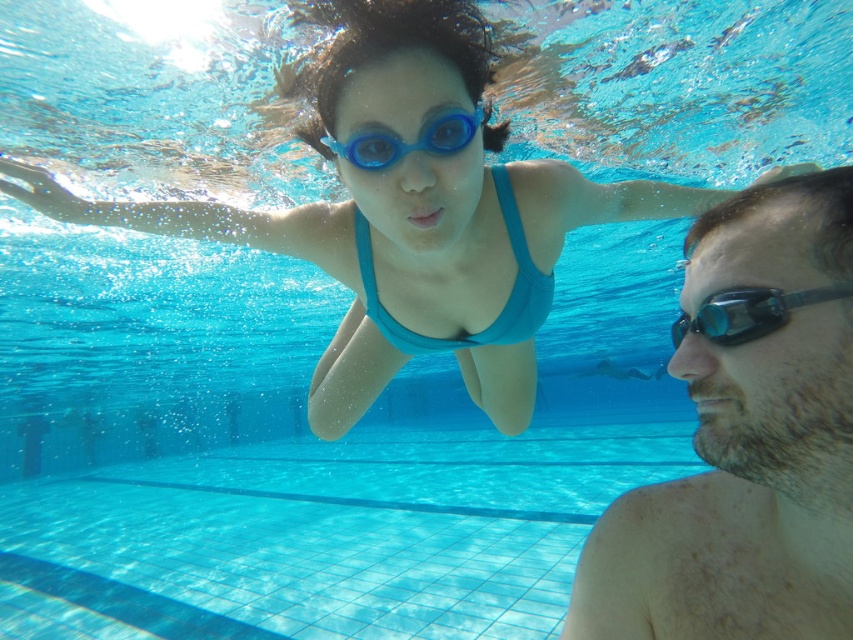
Question: Is smooth skin face at right positioned behind transparent rubber goggles at right?

Choices:
 (A) no
 (B) yes

Answer: (B)

Question: Is smooth skin face at right further to camera compared to transparent rubber goggles at right?

Choices:
 (A) no
 (B) yes

Answer: (B)

Question: Which object is farther from the camera taking this photo?

Choices:
 (A) blue matte swimsuit at center
 (B) teal fabric bikini top at center
 (C) transparent rubber goggles at right
 (D) smooth skin face at right

Answer: (B)

Question: Can you confirm if blue matte swimsuit at center is positioned to the left of teal fabric bikini top at center?

Choices:
 (A) yes
 (B) no

Answer: (A)

Question: Based on their relative distances, which object is nearer to the teal fabric bikini top at center?

Choices:
 (A) transparent rubber goggles at right
 (B) blue matte swimsuit at center
 (C) blue rubber goggles at center
 (D) smooth skin face at right

Answer: (B)

Question: Which of the following is the closest to the observer?

Choices:
 (A) teal fabric bikini top at center
 (B) blue matte swimsuit at center

Answer: (B)